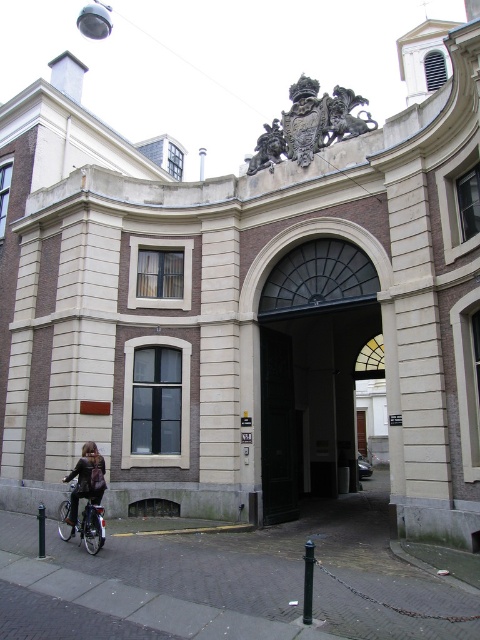
Question: Is matte black jacket at lower left closer to camera compared to bronze/golden statue at upper center?

Choices:
 (A) yes
 (B) no

Answer: (A)

Question: Which point appears closest to the camera in this image?

Choices:
 (A) (338, 90)
 (B) (312, 81)

Answer: (A)

Question: Which of these objects is positioned closest to the bronze/golden statue at upper center?

Choices:
 (A) bronze statue at center
 (B) gold metallic coat of arms at center top
 (C) silver metallic bicycle at lower left

Answer: (B)

Question: Observing the image, what is the correct spatial positioning of gold metallic coat of arms at center top in reference to matte black jacket at lower left?

Choices:
 (A) above
 (B) below

Answer: (A)

Question: Where is gold metallic coat of arms at center top located in relation to matte black jacket at lower left in the image?

Choices:
 (A) below
 (B) above

Answer: (B)

Question: Which of the following is the closest to the observer?

Choices:
 (A) (339, 118)
 (B) (104, 468)

Answer: (B)